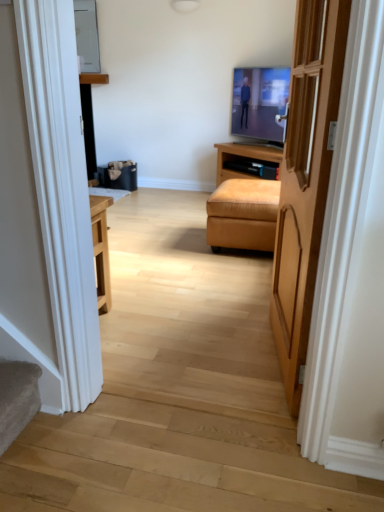
Question: From the image's perspective, would you say light brown wooden door at center is shown under flat screen tv at center?

Choices:
 (A) yes
 (B) no

Answer: (A)

Question: Can you confirm if light brown wooden door at center is bigger than flat screen tv at center?

Choices:
 (A) no
 (B) yes

Answer: (B)

Question: Does light brown wooden door at center have a lesser height compared to flat screen tv at center?

Choices:
 (A) yes
 (B) no

Answer: (B)

Question: Is light brown wooden door at center closer to the viewer compared to flat screen tv at center?

Choices:
 (A) no
 (B) yes

Answer: (B)

Question: Is light brown wooden door at center smaller than flat screen tv at center?

Choices:
 (A) no
 (B) yes

Answer: (A)

Question: Considering the positions of point (254, 112) and point (301, 265), is point (254, 112) closer or farther from the camera than point (301, 265)?

Choices:
 (A) closer
 (B) farther

Answer: (B)

Question: In terms of height, does flat screen tv at center look taller or shorter compared to light brown wooden door at center?

Choices:
 (A) tall
 (B) short

Answer: (B)

Question: From a real-world perspective, relative to light brown wooden door at center, is flat screen tv at center vertically above or below?

Choices:
 (A) above
 (B) below

Answer: (A)

Question: From the image's perspective, is flat screen tv at center located above or below light brown wooden door at center?

Choices:
 (A) above
 (B) below

Answer: (A)

Question: Is light brown wooden door at center to the left or to the right of flat screen tv at center in the image?

Choices:
 (A) right
 (B) left

Answer: (B)

Question: Is light brown wooden door at center inside or outside of flat screen tv at center?

Choices:
 (A) outside
 (B) inside

Answer: (A)

Question: Is light brown wooden door at center bigger or smaller than flat screen tv at center?

Choices:
 (A) big
 (B) small

Answer: (A)

Question: In the image, is light brown wooden door at center positioned in front of or behind flat screen tv at center?

Choices:
 (A) behind
 (B) front

Answer: (B)

Question: Is light brown wooden door at center inside or outside of suede-like tan ottoman at center?

Choices:
 (A) inside
 (B) outside

Answer: (B)

Question: Considering the positions of light brown wooden door at center and suede-like tan ottoman at center in the image, is light brown wooden door at center taller or shorter than suede-like tan ottoman at center?

Choices:
 (A) short
 (B) tall

Answer: (B)